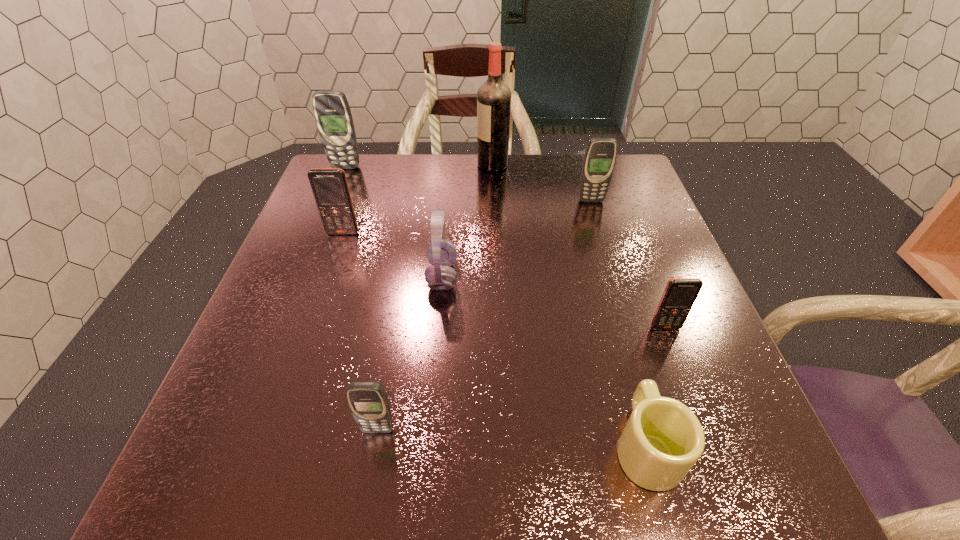
Point out which cellular telephone is positioned as the fourth nearest to the liquor. Please provide its 2D coordinates. Your answer should be formatted as a tuple, i.e. [(x, y)], where the tuple contains the x and y coordinates of a point satisfying the conditions above.

[(679, 295)]

Identify which cellular telephone is located as the second nearest to the tallest cellular telephone. Please provide its 2D coordinates. Your answer should be formatted as a tuple, i.e. [(x, y)], where the tuple contains the x and y coordinates of a point satisfying the conditions above.

[(600, 156)]

Choose which gray cellular telephone is the nearest neighbor to the rightmost cellular telephone. Please provide its 2D coordinates. Your answer should be formatted as a tuple, i.e. [(x, y)], where the tuple contains the x and y coordinates of a point satisfying the conditions above.

[(600, 156)]

Where is `the second closest gray cellular telephone to the mug`? The height and width of the screenshot is (540, 960). the second closest gray cellular telephone to the mug is located at coordinates (600, 156).

Locate an element on the screen. free space that satisfies the following two spatial constraints: 1. on the screen of the third farthest object; 2. on the headband and ear cups of the fourth object from left to right is located at coordinates (614, 276).

The height and width of the screenshot is (540, 960). Identify the location of vacant position in the image that satisfies the following two spatial constraints: 1. with the handle on the side of the beige mug; 2. on the front-facing side of the tallest object. (569, 165).

Image resolution: width=960 pixels, height=540 pixels. Find the location of `vacant area in the image that satisfies the following two spatial constraints: 1. on the front-facing side of the tallest object; 2. on the screen of the farther orange cellular telephone`. vacant area in the image that satisfies the following two spatial constraints: 1. on the front-facing side of the tallest object; 2. on the screen of the farther orange cellular telephone is located at coordinates (495, 233).

The image size is (960, 540). What are the coordinates of `vacant space that satisfies the following two spatial constraints: 1. on the screen of the second farthest cellular telephone; 2. on the headband and ear cups of the fifth object from right to left` in the screenshot? It's located at click(x=614, y=276).